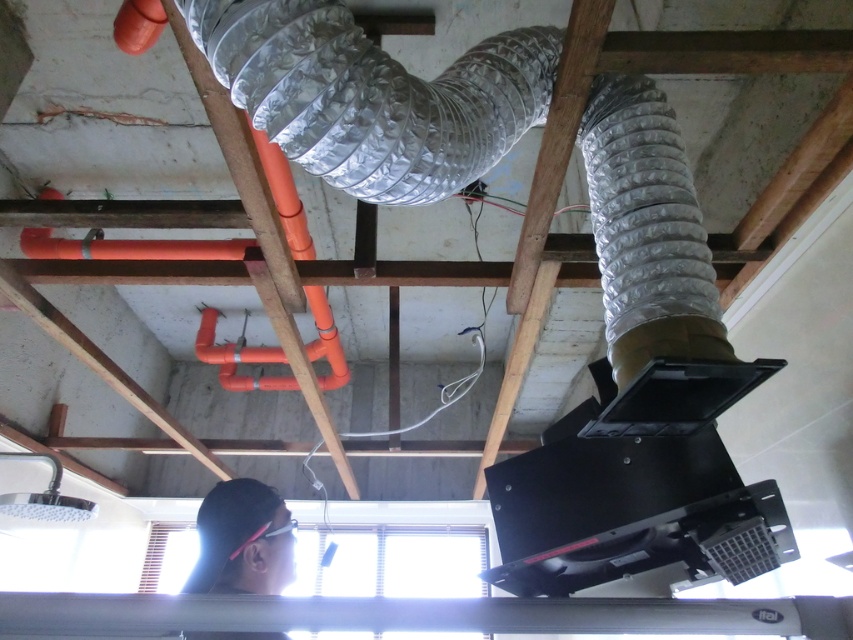
Is silver metallic duct at upper center above black matte hair at lower left?

Correct, silver metallic duct at upper center is located above black matte hair at lower left.

From the picture: Does silver metallic duct at upper center have a lesser width compared to black matte hair at lower left?

No.

Find the location of a particular element. The height and width of the screenshot is (640, 853). silver metallic duct at upper center is located at coordinates [373, 96].

I want to click on silver metallic duct at upper center, so click(x=373, y=96).